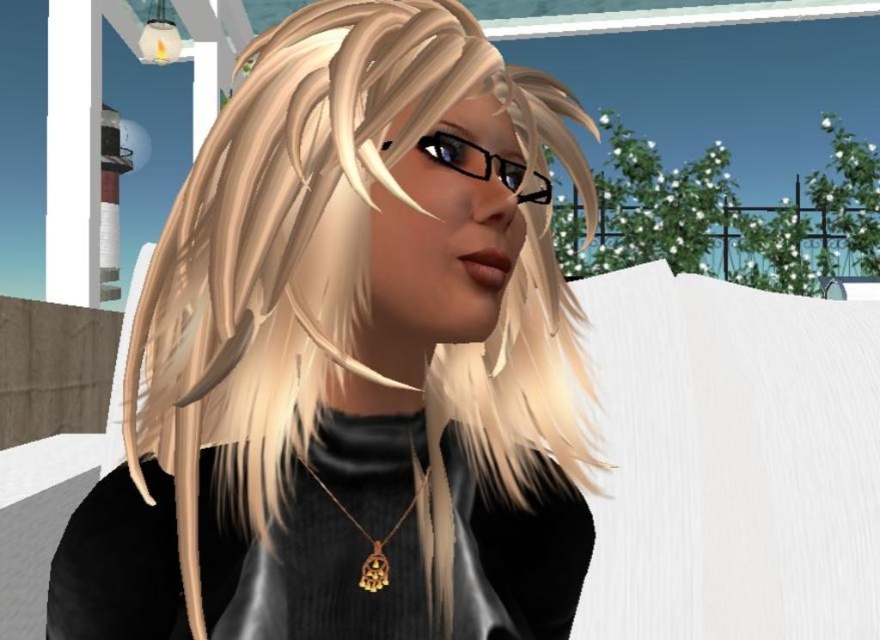
Question: Based on their relative distances, which object is farther from the blonde silky hair at center?

Choices:
 (A) gold metallic pendant at center
 (B) black plastic glasses at center

Answer: (A)

Question: Is blonde silky hair at center below black plastic glasses at center?

Choices:
 (A) yes
 (B) no

Answer: (A)

Question: Which of the following is the farthest from the observer?

Choices:
 (A) black plastic glasses at center
 (B) blonde silky hair at center
 (C) gold metallic pendant at center

Answer: (C)

Question: Estimate the real-world distances between objects in this image. Which object is closer to the gold metallic pendant at center?

Choices:
 (A) blonde silky hair at center
 (B) black plastic glasses at center

Answer: (B)

Question: Can you confirm if blonde silky hair at center is wider than gold metallic pendant at center?

Choices:
 (A) no
 (B) yes

Answer: (B)

Question: Does black plastic glasses at center appear on the left side of gold metallic pendant at center?

Choices:
 (A) no
 (B) yes

Answer: (A)